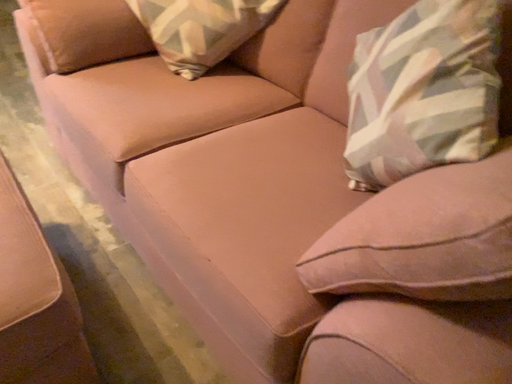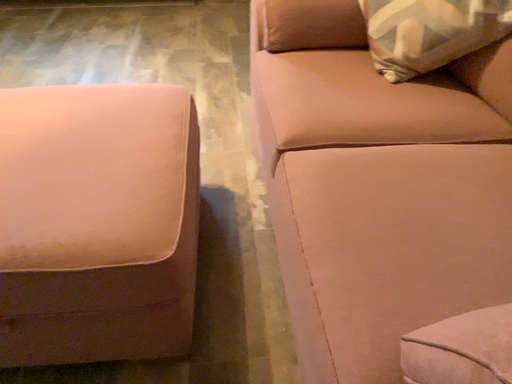
Question: How did the camera likely rotate when shooting the video?

Choices:
 (A) rotated left
 (B) rotated right

Answer: (A)